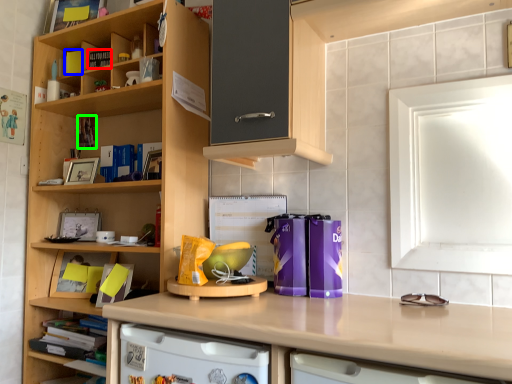
Question: Which object is positioned farthest from book (highlighted by a red box)? Select from book (highlighted by a blue box) and book (highlighted by a green box).

Choices:
 (A) book
 (B) book

Answer: (B)